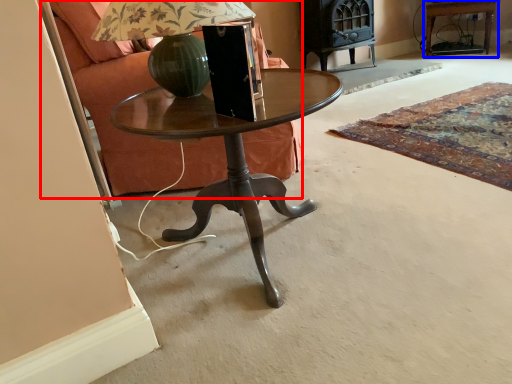
Question: Which point is closer to the camera, armchair (highlighted by a red box) or side table (highlighted by a blue box)?

Choices:
 (A) armchair
 (B) side table

Answer: (A)